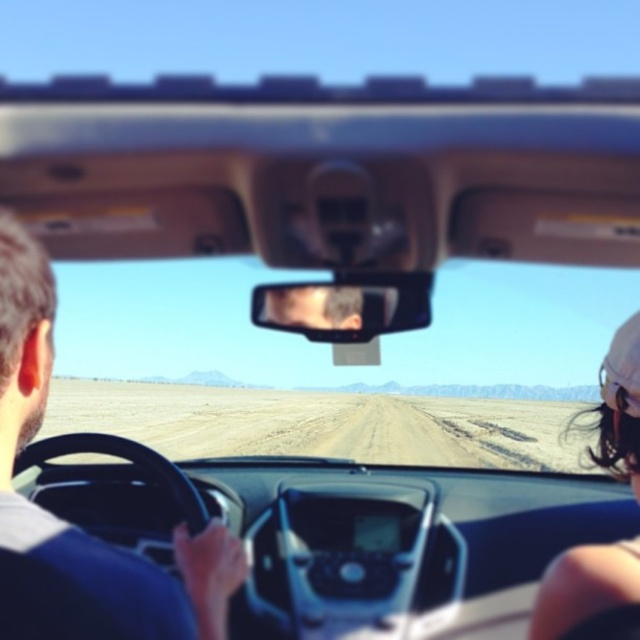
You are sitting in the passenger seat of the car and notice two items in your line of sight. The white fabric cap at right and the clear plastic view mirror at center. Which item is taller?

The white fabric cap at right is taller than the clear plastic view mirror at center.

You are sitting in the passenger seat of a car and notice two items in front of you. The white fabric cap at right and the clear plastic view mirror at center. Which item is wider?

The white fabric cap at right is wider than the clear plastic view mirror at center because its width surpasses the mirror.

You are sitting in the passenger seat of the car and want to reach both the brown leather steering wheel at left and the clear plastic view mirror at center. If your arm can extend 2 meters, can you comfortably reach both objects without moving your seat?

The brown leather steering wheel at left is 2.14 meters away from the clear plastic view mirror at center. Since your arm can only extend 2 meters, you cannot comfortably reach both objects simultaneously without moving your seat.